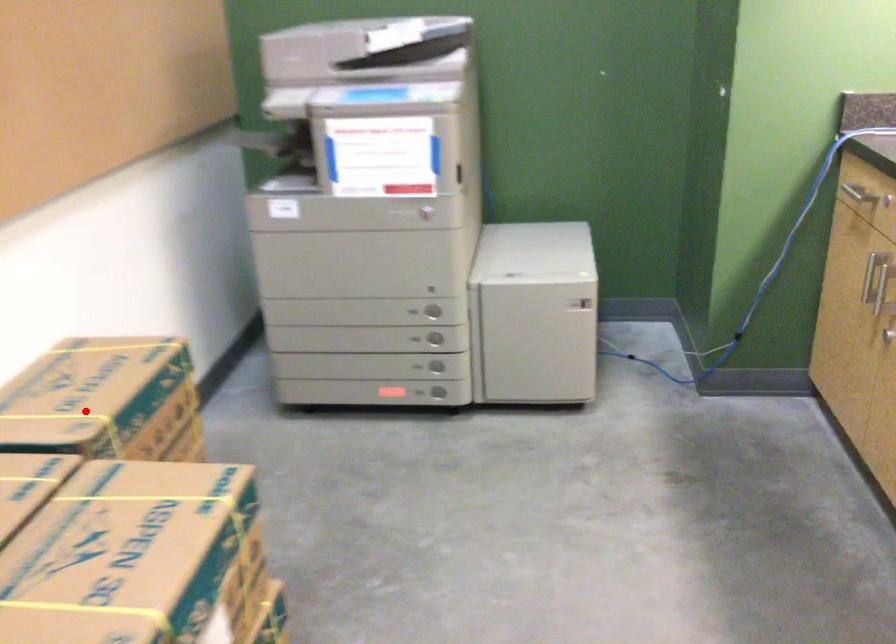
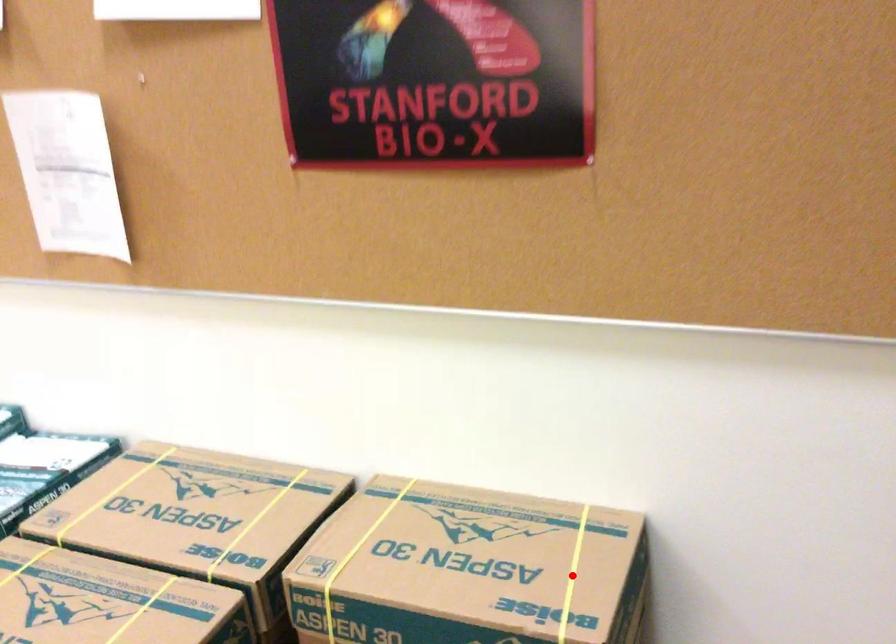
I am providing you with two images of the same scene from different viewpoints. A red point is marked on the first image and another point is marked on the second image. Do the highlighted points in image1 and image2 indicate the same real-world spot?

No